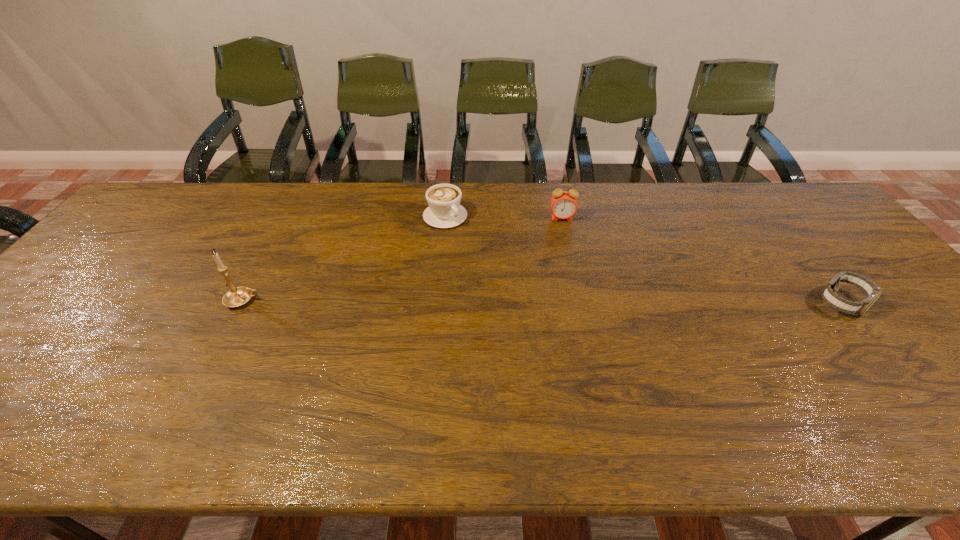
In the image, there is a desktop. Find the location of `vacant space at the far left corner`. vacant space at the far left corner is located at coordinates (166, 203).

Image resolution: width=960 pixels, height=540 pixels. In the image, there is a desktop. Find the location of `vacant space at the far right corner`. vacant space at the far right corner is located at coordinates (757, 183).

Image resolution: width=960 pixels, height=540 pixels. Find the location of `free area in between the leftmost object and the cappuccino`. free area in between the leftmost object and the cappuccino is located at coordinates (345, 258).

Locate an element on the screen. This screenshot has height=540, width=960. unoccupied area between the second object from left to right and the alarm clock is located at coordinates (504, 218).

This screenshot has width=960, height=540. Identify the location of empty space between the candle holder and the watch. (542, 301).

Find the location of `vacant region between the third object from left to right and the rightmost object`. vacant region between the third object from left to right and the rightmost object is located at coordinates (702, 261).

The height and width of the screenshot is (540, 960). Find the location of `free space that is in between the candle holder and the rightmost object`. free space that is in between the candle holder and the rightmost object is located at coordinates tap(542, 301).

You are a GUI agent. You are given a task and a screenshot of the screen. Output one action in this format:
    pyautogui.click(x=<x>, y=<y>)
    Task: Click on the free spot between the leftmost object and the cappuccino
    The width and height of the screenshot is (960, 540).
    Given the screenshot: What is the action you would take?
    pyautogui.click(x=345, y=258)

The image size is (960, 540). I want to click on free space between the alarm clock and the candle holder, so click(402, 259).

Identify the location of free space between the rightmost object and the alarm clock. (702, 261).